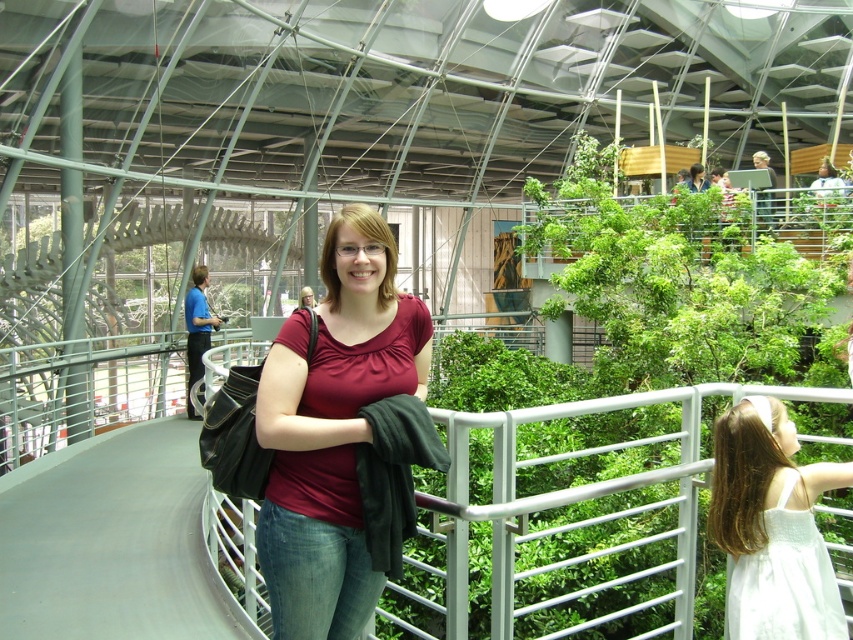
Question: Considering the real-world distances, which object is farthest from the matte red blouse at center?

Choices:
 (A) white satin dress at lower right
 (B) matte red shirt at center

Answer: (A)

Question: Is matte red blouse at center to the left of matte red shirt at center from the viewer's perspective?

Choices:
 (A) no
 (B) yes

Answer: (A)

Question: Can you confirm if white satin dress at lower right is thinner than matte red shirt at center?

Choices:
 (A) yes
 (B) no

Answer: (A)

Question: Can you confirm if white satin dress at lower right is positioned to the right of matte red shirt at center?

Choices:
 (A) yes
 (B) no

Answer: (A)

Question: Estimate the real-world distances between objects in this image. Which object is farther from the matte red shirt at center?

Choices:
 (A) white satin dress at lower right
 (B) matte red blouse at center

Answer: (A)

Question: Which point is farther from the camera taking this photo?

Choices:
 (A) (299, 305)
 (B) (740, 502)

Answer: (A)